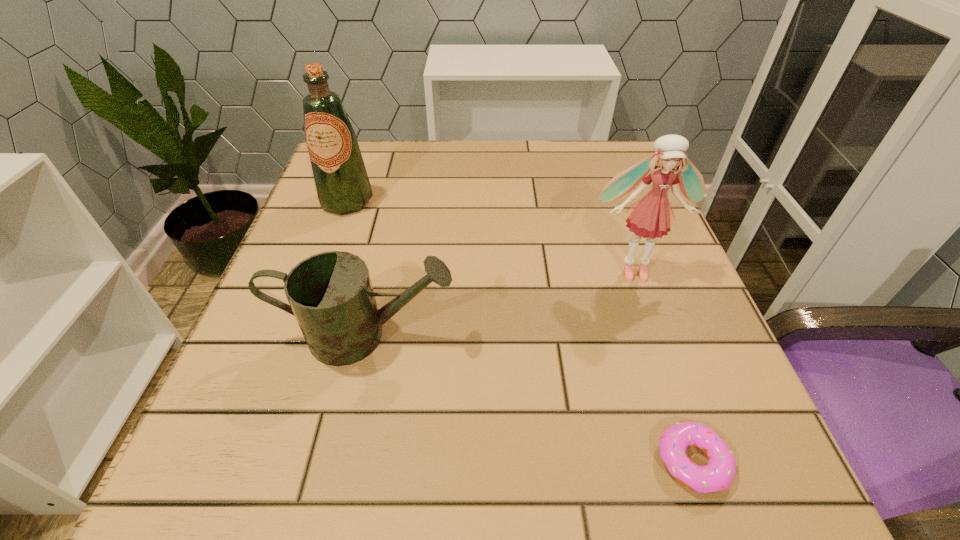
You are a GUI agent. You are given a task and a screenshot of the screen. Output one action in this format:
    pyautogui.click(x=<x>, y=<y>)
    Task: Click on the farthest object
    
    Given the screenshot: What is the action you would take?
    pyautogui.click(x=341, y=181)

This screenshot has width=960, height=540. In order to click on the third nearest object in this screenshot , I will do tap(651, 217).

Where is `watering can`? This screenshot has width=960, height=540. watering can is located at coordinates (330, 294).

This screenshot has height=540, width=960. Identify the location of the second nearest object. (330, 294).

At what (x,y) coordinates should I click in order to perform the action: click on doughnut. Please return your answer as a coordinate pair (x, y). The image size is (960, 540). Looking at the image, I should click on (718, 475).

At what (x,y) coordinates should I click in order to perform the action: click on the nearest object. Please return your answer as a coordinate pair (x, y). Looking at the image, I should click on (718, 475).

This screenshot has height=540, width=960. I want to click on vacant space located 0.180m on the front-facing side of the olive oil, so click(x=319, y=278).

Identify the location of blank space located on the front-facing side of the doll. (671, 378).

At what (x,y) coordinates should I click in order to perform the action: click on vacant space located 0.150m with the spout on the watering can. Please return your answer as a coordinate pair (x, y). Looking at the image, I should click on (549, 336).

The image size is (960, 540). In order to click on vacant region located 0.080m on the left of the shortest object in this screenshot , I will do `click(594, 462)`.